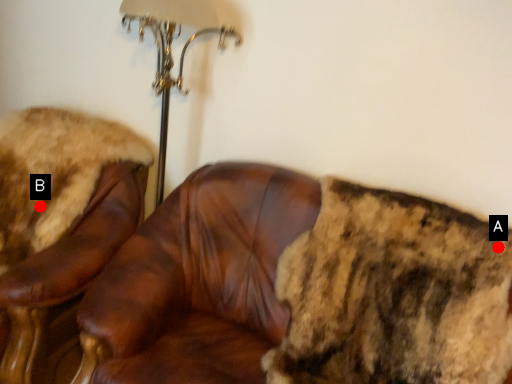
Question: Two points are circled on the image, labeled by A and B beside each circle. Which of the following is the closest to the observer?

Choices:
 (A) A is closer
 (B) B is closer

Answer: (A)